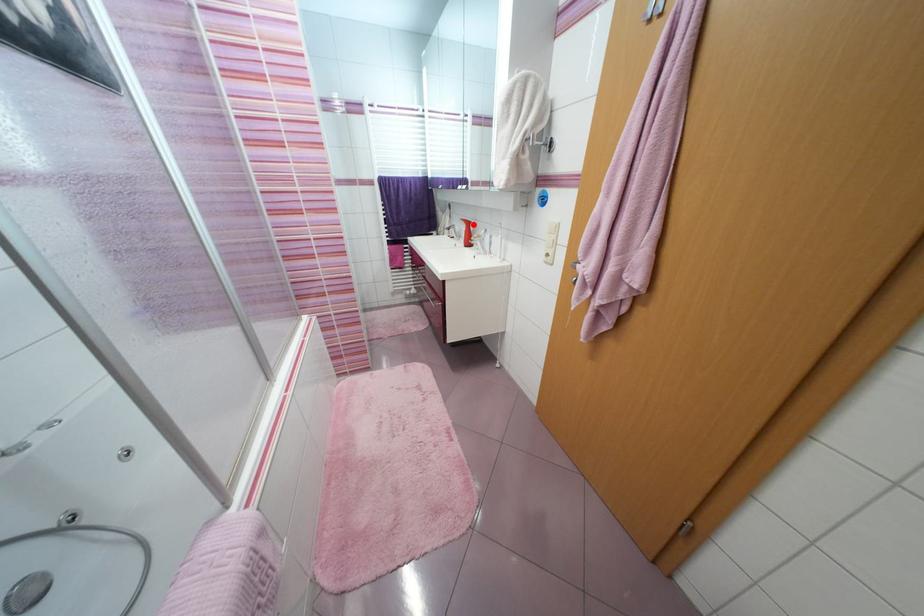
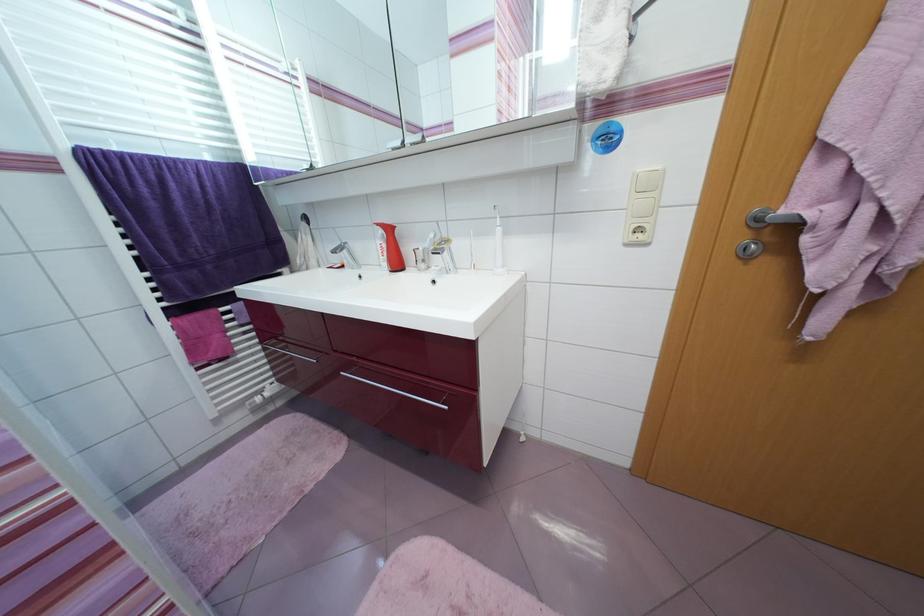
Locate, in the second image, the point that corresponds to the highlighted location in the first image.

(394, 231)